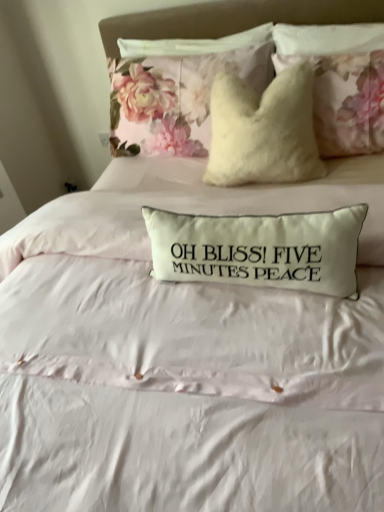
What are the coordinates of `floral fabric cushion at upper center, which is the 2th pillow from bottom to top` in the screenshot? It's located at (180, 94).

This screenshot has height=512, width=384. Describe the element at coordinates (230, 19) in the screenshot. I see `fluffy white pillow at upper center` at that location.

Identify the location of white fabric pillow at center, the 1th pillow viewed from the front. Image resolution: width=384 pixels, height=512 pixels. (259, 249).

Locate an element on the screen. This screenshot has width=384, height=512. floral fabric cushion at upper center, which is the 1th pillow in top-to-bottom order is located at coordinates (180, 94).

Is fluffy white pillow at upper center to the left of white fabric pillow at center, the 1th pillow viewed from the front, from the viewer's perspective?

No.

Which is correct: fluffy white pillow at upper center is inside white fabric pillow at center, marked as the 2th pillow in a back-to-front arrangement, or outside of it?

The correct answer is: outside.

Could you measure the distance between fluffy white pillow at upper center and white fabric pillow at center, marked as the 2th pillow in a back-to-front arrangement?

3.80 feet.

The image size is (384, 512). There is a white fabric pillow at center, the 1th pillow viewed from the front. What are the coordinates of `headboard above it (from a real-world perspective)` in the screenshot? It's located at click(x=230, y=19).

Is floral fabric cushion at upper center, which is the 1th pillow in top-to-bottom order, bigger than white fabric pillow at center, placed as the 2th pillow when sorted from top to bottom?

Yes, floral fabric cushion at upper center, which is the 1th pillow in top-to-bottom order, is bigger than white fabric pillow at center, placed as the 2th pillow when sorted from top to bottom.

Is floral fabric cushion at upper center, positioned as the first pillow in back-to-front order, far away from white fabric pillow at center, acting as the 1th pillow starting from the bottom?

No, floral fabric cushion at upper center, positioned as the first pillow in back-to-front order, is not far from white fabric pillow at center, acting as the 1th pillow starting from the bottom.

From a real-world perspective, is floral fabric cushion at upper center, which is the 2th pillow from bottom to top, beneath white fabric pillow at center, marked as the 2th pillow in a back-to-front arrangement?

No.

Is floral fabric cushion at upper center, which is the 2th pillow from bottom to top, in front of white fabric pillow at center, acting as the 1th pillow starting from the bottom?

No, it is behind white fabric pillow at center, acting as the 1th pillow starting from the bottom.

Considering the sizes of fluffy white pillow at upper center and floral fabric cushion at upper center, the 2th pillow from the front, in the image, is fluffy white pillow at upper center taller or shorter than floral fabric cushion at upper center, the 2th pillow from the front,?

Considering their sizes, fluffy white pillow at upper center has more height than floral fabric cushion at upper center, the 2th pillow from the front.

Which is correct: fluffy white pillow at upper center is inside floral fabric cushion at upper center, positioned as the first pillow in back-to-front order, or outside of it?

fluffy white pillow at upper center is outside floral fabric cushion at upper center, positioned as the first pillow in back-to-front order.

Could you tell me if fluffy white pillow at upper center is facing floral fabric cushion at upper center, which is the 2th pillow from bottom to top?

No, fluffy white pillow at upper center does not turn towards floral fabric cushion at upper center, which is the 2th pillow from bottom to top.

Considering the sizes of objects fluffy white pillow at upper center and floral fabric cushion at upper center, positioned as the first pillow in back-to-front order, in the image provided, who is smaller, fluffy white pillow at upper center or floral fabric cushion at upper center, positioned as the first pillow in back-to-front order,?

fluffy white pillow at upper center is smaller.

The width and height of the screenshot is (384, 512). What are the coordinates of `headboard behind the white fabric pillow at center, acting as the 1th pillow starting from the bottom` in the screenshot? It's located at (230, 19).

Considering the relative positions of white fabric pillow at center, acting as the 1th pillow starting from the bottom, and fluffy white pillow at upper center in the image provided, is white fabric pillow at center, acting as the 1th pillow starting from the bottom, to the right of fluffy white pillow at upper center from the viewer's perspective?

No.

Which is farther, (x=253, y=285) or (x=186, y=10)?

Point (x=186, y=10)

Find the location of a particular element. This screenshot has height=512, width=384. pillow that is the 1st object directly below the fluffy white pillow at upper center (from a real-world perspective) is located at coordinates coord(180,94).

Is floral fabric cushion at upper center, which is the 1th pillow in top-to-bottom order, directly adjacent to fluffy white pillow at upper center?

No, floral fabric cushion at upper center, which is the 1th pillow in top-to-bottom order, is not touching fluffy white pillow at upper center.

Between floral fabric cushion at upper center, positioned as the first pillow in back-to-front order, and fluffy white pillow at upper center, which one appears on the left side from the viewer's perspective?

From the viewer's perspective, floral fabric cushion at upper center, positioned as the first pillow in back-to-front order, appears more on the left side.

Looking at this image, from the image's perspective, which one is positioned lower, floral fabric cushion at upper center, which is the 1th pillow in top-to-bottom order, or fluffy white pillow at upper center?

fluffy white pillow at upper center appears lower in the image.

Is white fabric pillow at center, marked as the 2th pillow in a back-to-front arrangement, spatially inside floral fabric cushion at upper center, the 2th pillow from the front, or outside of it?

white fabric pillow at center, marked as the 2th pillow in a back-to-front arrangement, exists outside the volume of floral fabric cushion at upper center, the 2th pillow from the front.

Image resolution: width=384 pixels, height=512 pixels. In order to click on pillow that appears in front of the floral fabric cushion at upper center, positioned as the first pillow in back-to-front order in this screenshot , I will do `click(259, 249)`.

Are white fabric pillow at center, marked as the 2th pillow in a back-to-front arrangement, and floral fabric cushion at upper center, positioned as the first pillow in back-to-front order, beside each other?

There is a gap between white fabric pillow at center, marked as the 2th pillow in a back-to-front arrangement, and floral fabric cushion at upper center, positioned as the first pillow in back-to-front order.

Based on the photo, from a real-world perspective, between white fabric pillow at center, marked as the 2th pillow in a back-to-front arrangement, and floral fabric cushion at upper center, which is the 1th pillow in top-to-bottom order, who is vertically higher?

In real-world perspective, floral fabric cushion at upper center, which is the 1th pillow in top-to-bottom order, is above.

Image resolution: width=384 pixels, height=512 pixels. In order to click on pillow lying below the fluffy white pillow at upper center (from the image's perspective) in this screenshot , I will do `click(259, 249)`.

Identify the location of pillow below the floral fabric cushion at upper center, the 2th pillow from the front (from a real-world perspective). This screenshot has height=512, width=384. (259, 249).

Based on their spatial positions, is fluffy white pillow at upper center or floral fabric cushion at upper center, which is the 2th pillow from bottom to top, further from white fabric pillow at center, the 1th pillow viewed from the front?

fluffy white pillow at upper center is further to white fabric pillow at center, the 1th pillow viewed from the front.

From the image, which object appears to be farther from fluffy white pillow at upper center, floral fabric cushion at upper center, positioned as the first pillow in back-to-front order, or white fabric pillow at center, marked as the 2th pillow in a back-to-front arrangement?

white fabric pillow at center, marked as the 2th pillow in a back-to-front arrangement, lies further to fluffy white pillow at upper center than the other object.

From the image, which object appears to be farther from fluffy white pillow at upper center, white fabric pillow at center, placed as the 2th pillow when sorted from top to bottom, or floral fabric cushion at upper center, the 2th pillow from the front?

Based on the image, white fabric pillow at center, placed as the 2th pillow when sorted from top to bottom, appears to be further to fluffy white pillow at upper center.

Based on their spatial positions, is floral fabric cushion at upper center, which is the 2th pillow from bottom to top, or fluffy white pillow at upper center closer to white fabric pillow at center, placed as the 2th pillow when sorted from top to bottom?

floral fabric cushion at upper center, which is the 2th pillow from bottom to top, lies closer to white fabric pillow at center, placed as the 2th pillow when sorted from top to bottom, than the other object.

Looking at the image, which one is located further to floral fabric cushion at upper center, the 2th pillow from the front, fluffy white pillow at upper center or white fabric pillow at center, the 1th pillow viewed from the front?

Among the two, white fabric pillow at center, the 1th pillow viewed from the front, is located further to floral fabric cushion at upper center, the 2th pillow from the front.

Considering their positions, is white fabric pillow at center, the 1th pillow viewed from the front, positioned further to floral fabric cushion at upper center, positioned as the first pillow in back-to-front order, than fluffy white pillow at upper center?

white fabric pillow at center, the 1th pillow viewed from the front, is positioned further to the anchor floral fabric cushion at upper center, positioned as the first pillow in back-to-front order.

What are the coordinates of `headboard between floral fabric cushion at upper center, the 2th pillow from the front, and white fabric pillow at center, placed as the 2th pillow when sorted from top to bottom, from top to bottom` in the screenshot? It's located at click(x=230, y=19).